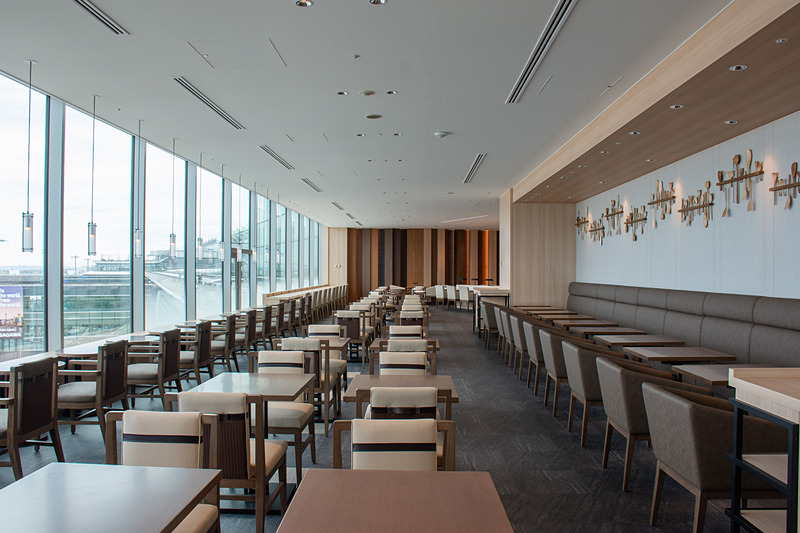
Locate an element on the screen. This screenshot has height=533, width=800. utensils hanging on the wall is located at coordinates (582, 222), (596, 228), (614, 209), (636, 220), (666, 197), (694, 208), (742, 177), (782, 187).